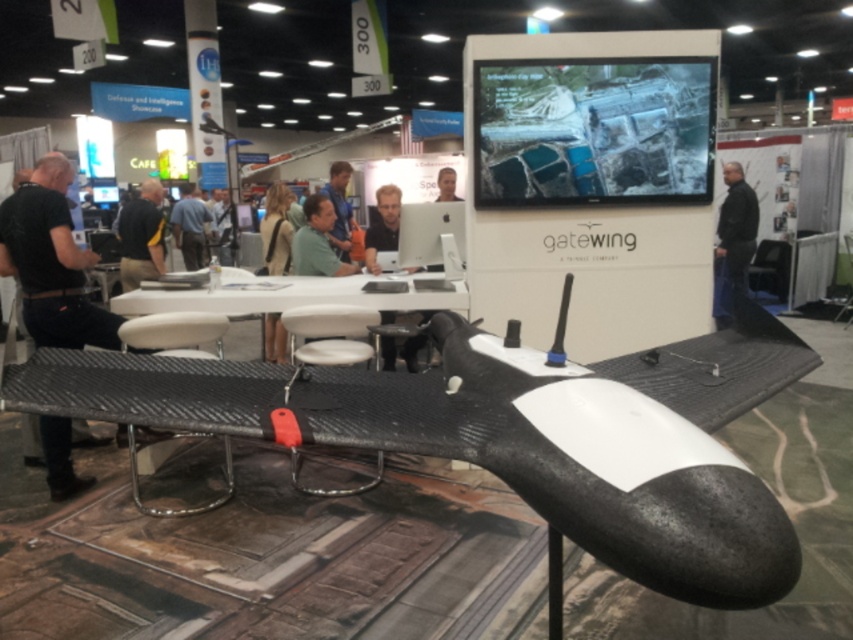
Is carbon fiber plane at center positioned in front of black fabric shirt at center?

Yes, it is.

The height and width of the screenshot is (640, 853). I want to click on carbon fiber plane at center, so click(x=598, y=445).

Who is shorter, black fabric shirt at left or matte black laptop at center?

With less height is matte black laptop at center.

Is point (131, 244) positioned before point (364, 244)?

That is False.

Who is more distant from viewer, (144, 193) or (430, 314)?

The point (144, 193) is more distant.

You are a GUI agent. You are given a task and a screenshot of the screen. Output one action in this format:
    pyautogui.click(x=<x>, y=<y>)
    Task: Click on the black fabric shirt at left
    This screenshot has width=853, height=640.
    Given the screenshot: What is the action you would take?
    pyautogui.click(x=141, y=236)

Does carbon fiber plane at center have a greater width compared to green matte shirt at center?

Correct, the width of carbon fiber plane at center exceeds that of green matte shirt at center.

Consider the image. Is carbon fiber plane at center shorter than green matte shirt at center?

Indeed, carbon fiber plane at center has a lesser height compared to green matte shirt at center.

Describe the element at coordinates (598, 445) in the screenshot. The height and width of the screenshot is (640, 853). I see `carbon fiber plane at center` at that location.

Locate an element on the screen. This screenshot has height=640, width=853. carbon fiber plane at center is located at coordinates (598, 445).